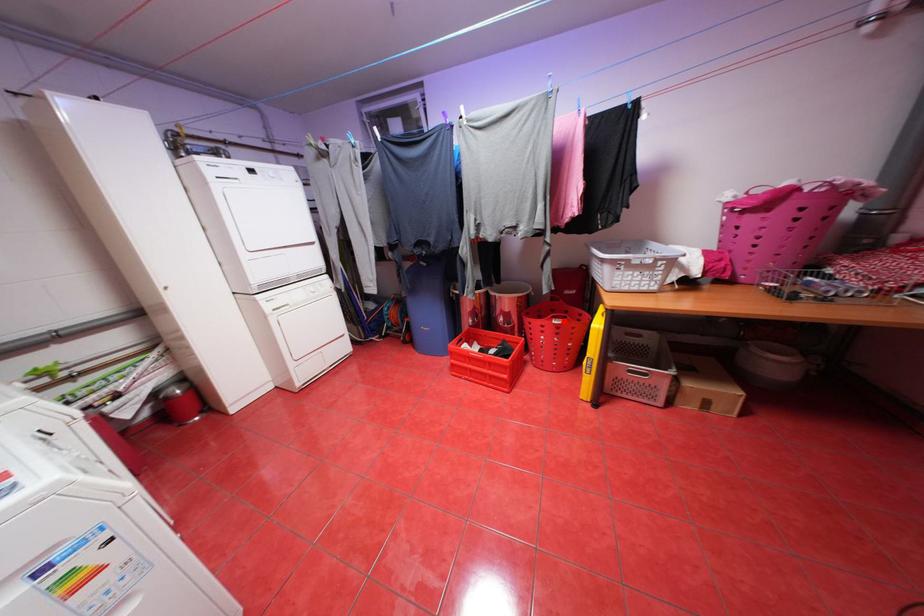
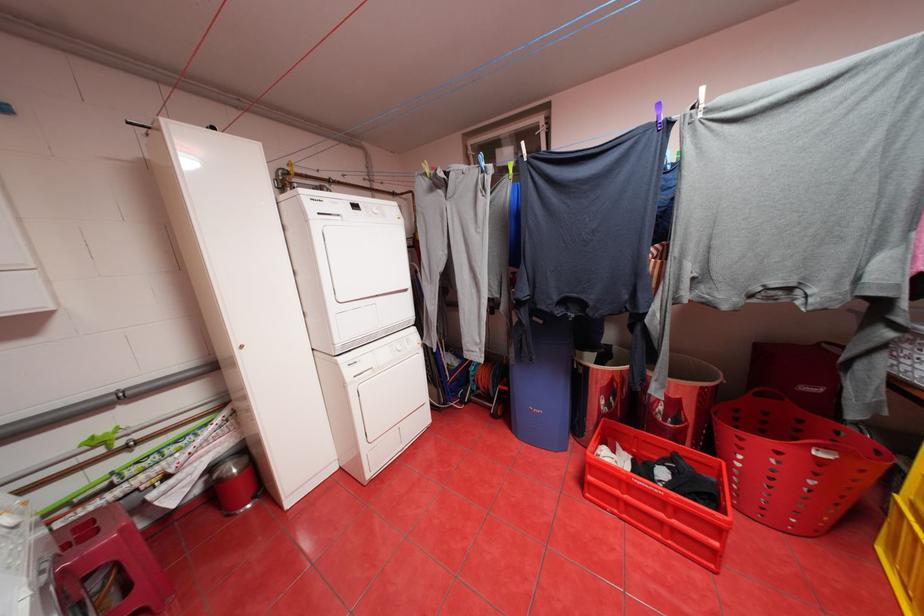
Question: I am providing you with two images of the same scene from different viewpoints. Image1 has a red point marked. In image2, the corresponding 3D location appears at what relative position? Reply with the corresponding letter.

Choices:
 (A) Closer
 (B) Farther

Answer: (A)